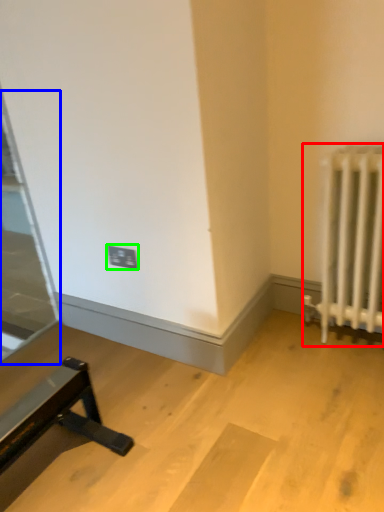
Question: Which object is positioned farthest from radiator (highlighted by a red box)? Select from glass door (highlighted by a blue box) and electric outlet (highlighted by a green box).

Choices:
 (A) glass door
 (B) electric outlet

Answer: (A)